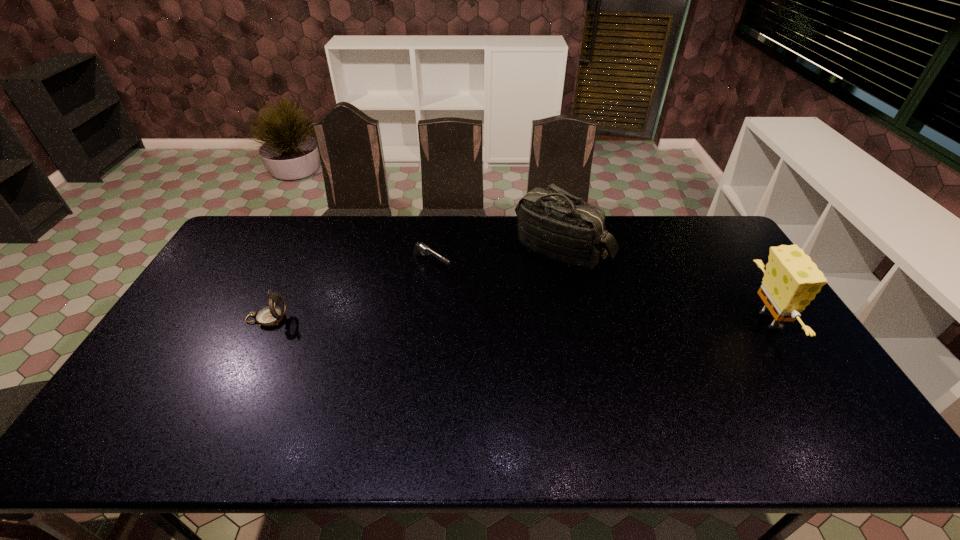
You are a GUI agent. You are given a task and a screenshot of the screen. Output one action in this format:
    pyautogui.click(x=<x>, y=<y>)
    Task: Click on the unoccupied position between the shortest object and the leftmost object
    The image size is (960, 540).
    Given the screenshot: What is the action you would take?
    pyautogui.click(x=349, y=292)

The image size is (960, 540). What are the coordinates of `empty space between the leftmost object and the sponge` in the screenshot? It's located at (517, 320).

At what (x,y) coordinates should I click in order to perform the action: click on the closest object to the sponge. Please return your answer as a coordinate pair (x, y). Image resolution: width=960 pixels, height=540 pixels. Looking at the image, I should click on (552, 223).

The image size is (960, 540). I want to click on object that is the second closest one to the leftmost object, so (x=552, y=223).

At what (x,y) coordinates should I click in order to perform the action: click on vacant position in the image that satisfies the following two spatial constraints: 1. on the back side of the pistol; 2. on the right side of the shoulder bag. Please return your answer as a coordinate pair (x, y). This screenshot has width=960, height=540. Looking at the image, I should click on tap(433, 251).

This screenshot has height=540, width=960. I want to click on vacant region that satisfies the following two spatial constraints: 1. on the front side of the shoulder bag; 2. on the face of the rightmost object, so click(578, 322).

At what (x,y) coordinates should I click in order to perform the action: click on vacant space that satisfies the following two spatial constraints: 1. on the front side of the pistol; 2. on the face of the sponge. Please return your answer as a coordinate pair (x, y). Looking at the image, I should click on (424, 322).